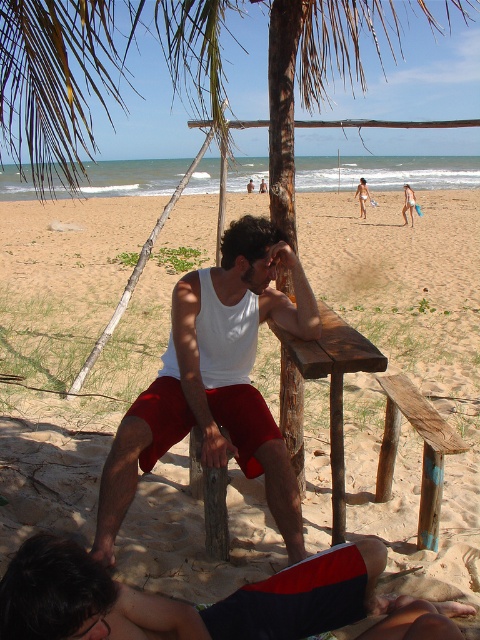
Question: Which of the following is the closest to the observer?

Choices:
 (A) (189, 355)
 (B) (393, 346)
 (C) (36, 593)

Answer: (C)

Question: Is white matte tank top at center further to the viewer compared to black matte shorts at lower center?

Choices:
 (A) yes
 (B) no

Answer: (A)

Question: Which object is the closest to the black matte shorts at lower center?

Choices:
 (A) wooden bench at center
 (B) brown wooden bench at center

Answer: (B)

Question: Can you confirm if wooden bench at center is thinner than black matte shorts at lower center?

Choices:
 (A) no
 (B) yes

Answer: (A)

Question: Does black matte shorts at lower center appear under brown wooden bench at center?

Choices:
 (A) yes
 (B) no

Answer: (A)

Question: Which point appears closest to the camera in this image?

Choices:
 (A) (447, 628)
 (B) (324, 330)
 (C) (204, 387)
 (D) (447, 268)

Answer: (A)